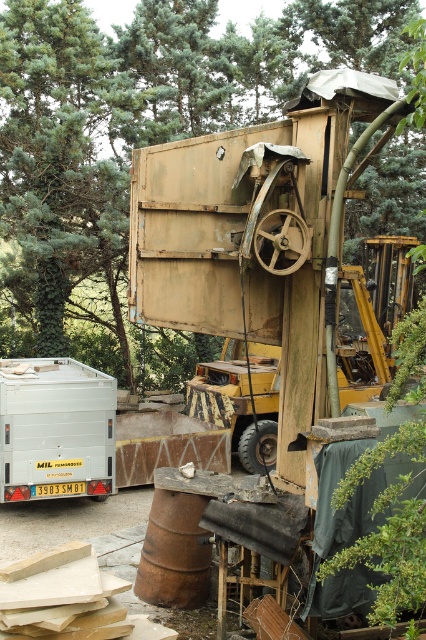
Question: Which of the following is the farthest from the observer?

Choices:
 (A) (103, 124)
 (B) (310, 26)

Answer: (B)

Question: Which of the following is the farthest from the observer?

Choices:
 (A) white matte trailer at lower left
 (B) green leafy tree at upper left

Answer: (B)

Question: Which object is the closest to the white matte trailer at lower left?

Choices:
 (A) green leafy tree at upper center
 (B) green leafy tree at upper left

Answer: (A)

Question: Can you confirm if green leafy tree at upper left is positioned below white matte trailer at lower left?

Choices:
 (A) yes
 (B) no

Answer: (B)

Question: In this image, where is green leafy tree at upper center located relative to green leafy tree at upper left?

Choices:
 (A) above
 (B) below

Answer: (A)

Question: In this image, where is green leafy tree at upper center located relative to white matte trailer at lower left?

Choices:
 (A) left
 (B) right

Answer: (B)